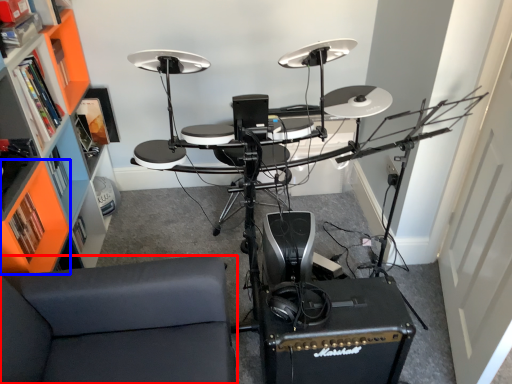
Question: Which point is closer to the camera, furniture (highlighted by a red box) or shelf (highlighted by a blue box)?

Choices:
 (A) furniture
 (B) shelf

Answer: (A)